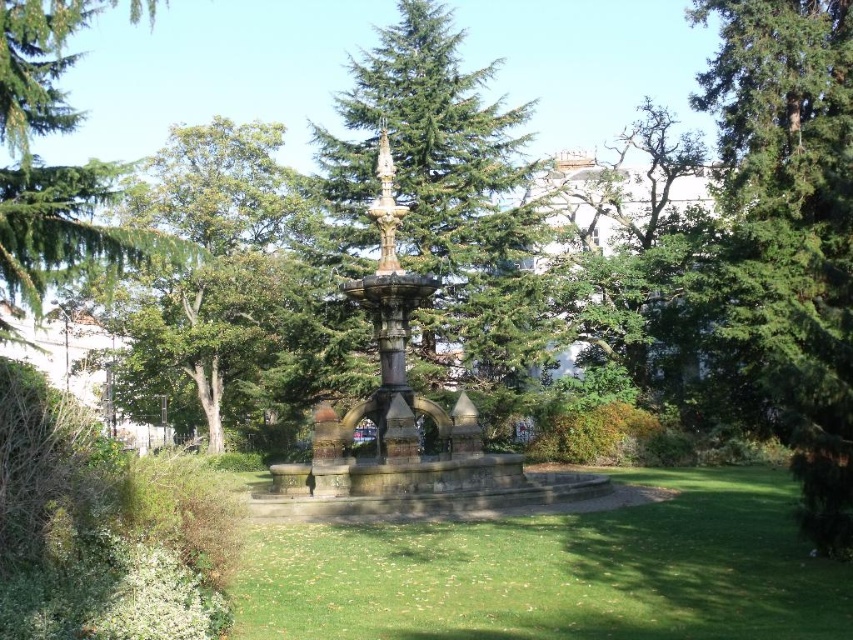
Does point (318, 561) lie in front of point (47, 220)?

Yes.

Which is more to the left, green grass at center or green needle-like leaves at upper left?

From the viewer's perspective, green needle-like leaves at upper left appears more on the left side.

Does point (714, 547) lie in front of point (68, 8)?

Yes, it is in front of point (68, 8).

What are the coordinates of `green grass at center` in the screenshot? It's located at (556, 572).

Is green leafy tree at center shorter than green needle-like leaves at upper left?

Yes, green leafy tree at center is shorter than green needle-like leaves at upper left.

I want to click on green leafy tree at center, so click(213, 260).

Is point (171, 157) behind point (78, 244)?

Yes, point (171, 157) is farther from viewer.

This screenshot has width=853, height=640. I want to click on green leafy tree at center, so [213, 260].

Is point (331, 454) behind point (144, 256)?

That is False.

Locate an element on the screen. gold polished fountain at center is located at coordinates (405, 422).